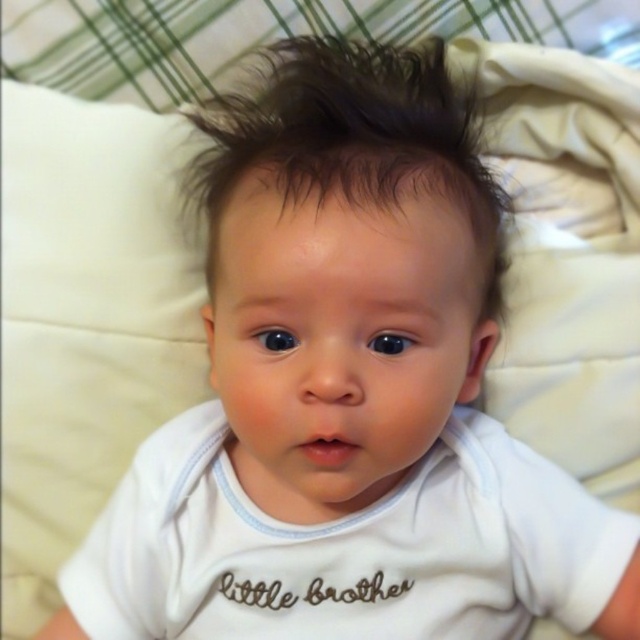
Image resolution: width=640 pixels, height=640 pixels. Find the location of `white soft fabric shirt at center`. white soft fabric shirt at center is located at coordinates (x=348, y=547).

Is white soft fabric shirt at center above dark brown shiny hair at center?

Actually, white soft fabric shirt at center is below dark brown shiny hair at center.

Is point (632, 536) positioned after point (332, 164)?

Yes, point (632, 536) is behind point (332, 164).

This screenshot has height=640, width=640. What are the coordinates of `white soft fabric shirt at center` in the screenshot? It's located at (348, 547).